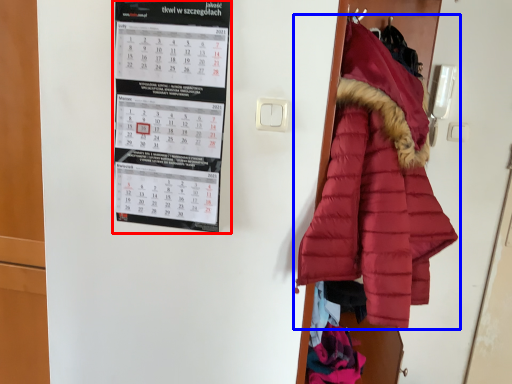
Question: Which object appears closest to the camera in this image, bulletin board (highlighted by a red box) or coat (highlighted by a blue box)?

Choices:
 (A) bulletin board
 (B) coat

Answer: (B)